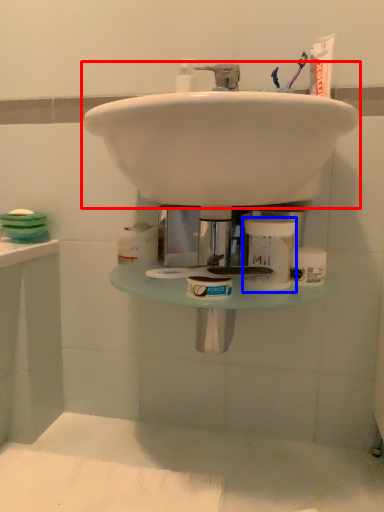
Question: Which object is closer to the camera taking this photo, sink (highlighted by a red box) or toiletry (highlighted by a blue box)?

Choices:
 (A) sink
 (B) toiletry

Answer: (A)